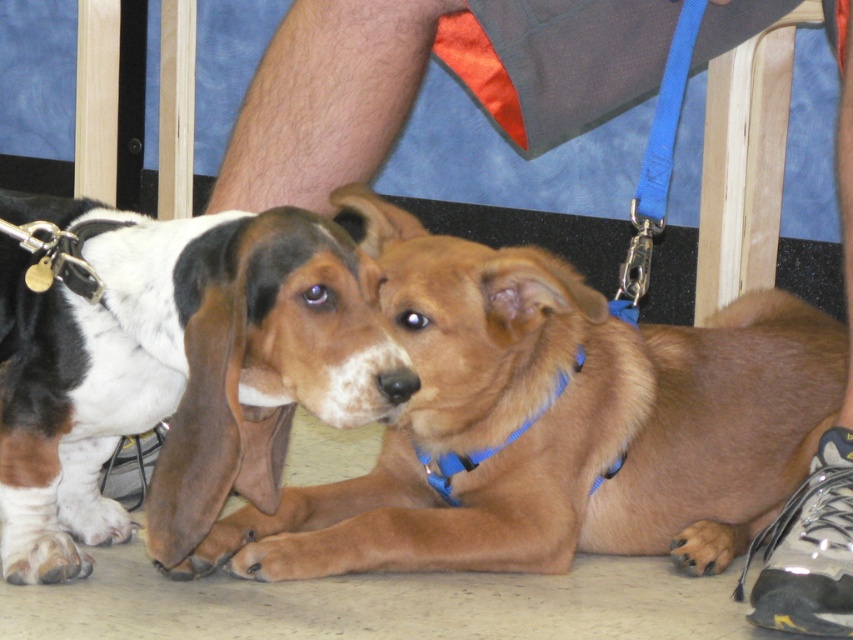
You are a volunteer at an adoption event and need to identify the dogs. The brown fur dog at center and the blue fabric neckband at center are both in your view. Which object is positioned higher in the image?

The brown fur dog at center is located above the blue fabric neckband at center, so it is positioned higher in the image.